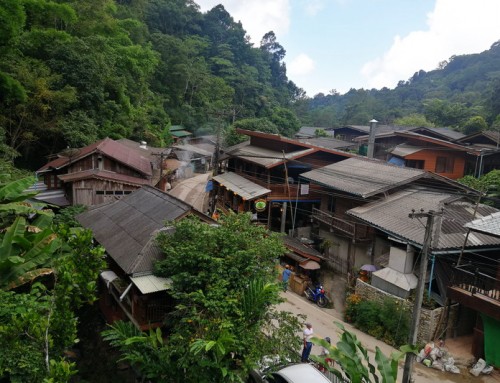
This screenshot has height=383, width=500. Identify the location of trash. (442, 354).